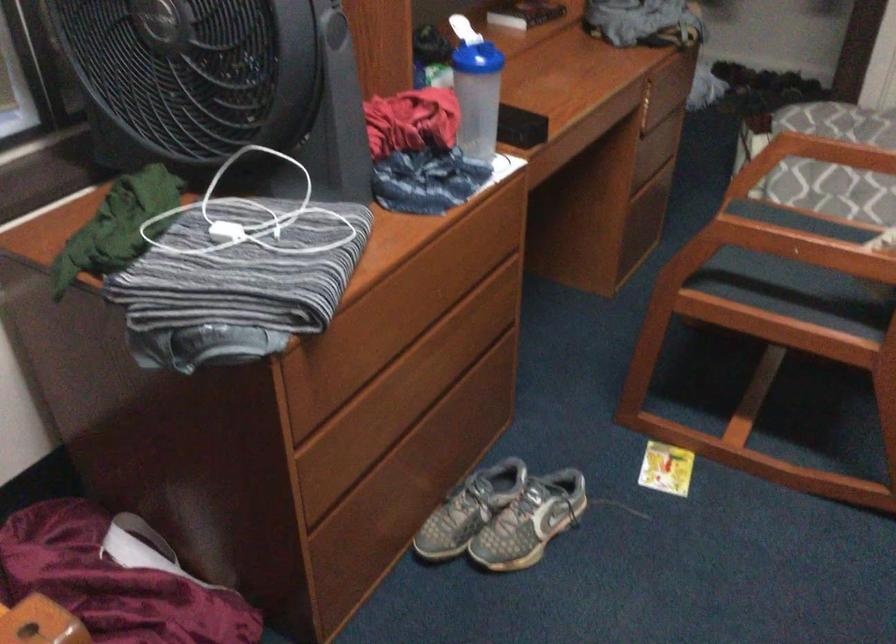
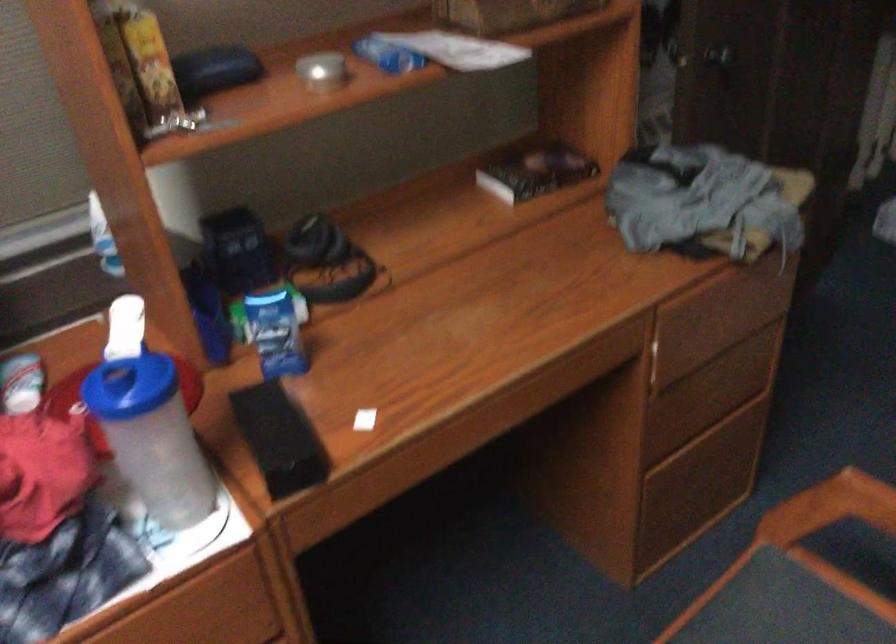
The point at (x=495, y=91) is marked in the first image. Where is the corresponding point in the second image?

(151, 437)